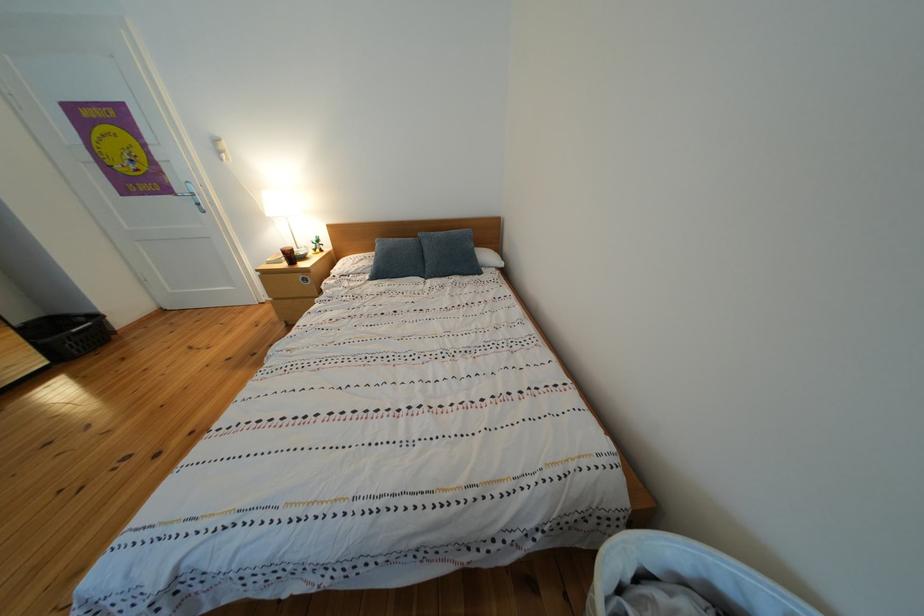
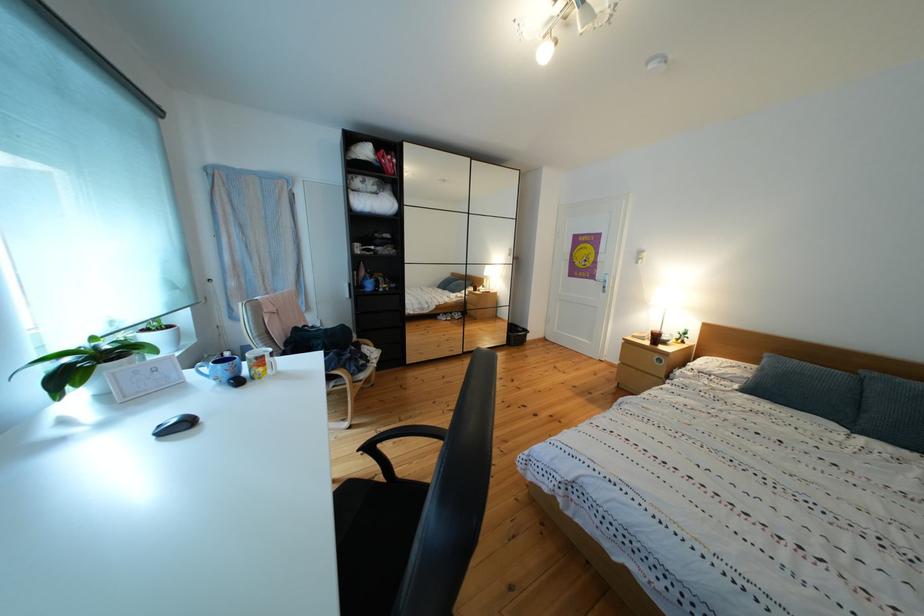
Find the pixel in the second image that matches (x=379, y=283) in the first image.

(748, 392)